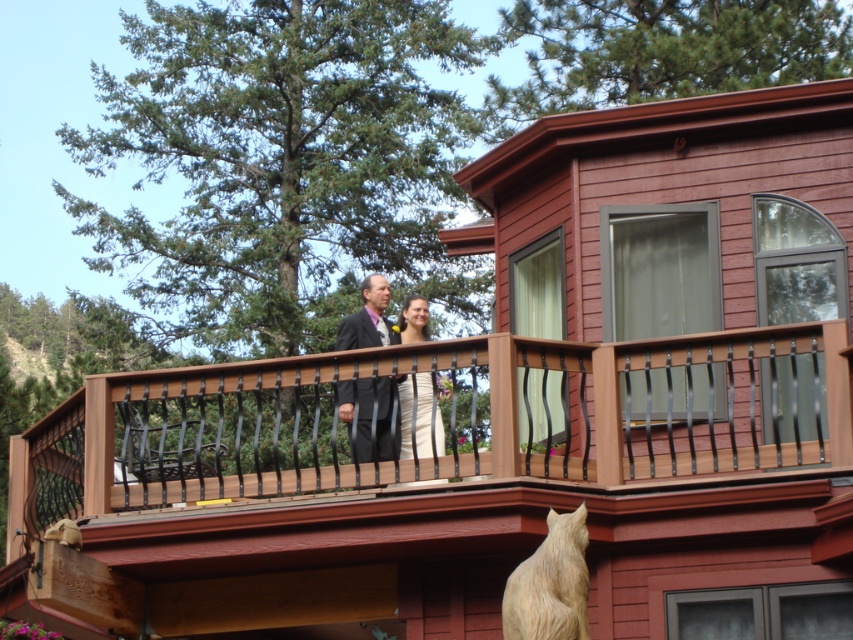
Question: Which object is closer to the camera taking this photo?

Choices:
 (A) white satin dress at center
 (B) dark suit at center

Answer: (A)

Question: Considering the relative positions of dark suit at center and white satin dress at center in the image provided, where is dark suit at center located with respect to white satin dress at center?

Choices:
 (A) above
 (B) below

Answer: (B)

Question: Is dark suit at center to the left of white satin dress at center from the viewer's perspective?

Choices:
 (A) no
 (B) yes

Answer: (B)

Question: Which point is closer to the camera?

Choices:
 (A) white satin dress at center
 (B) dark suit at center

Answer: (A)

Question: Where is dark suit at center located in relation to white satin dress at center in the image?

Choices:
 (A) right
 (B) left

Answer: (B)